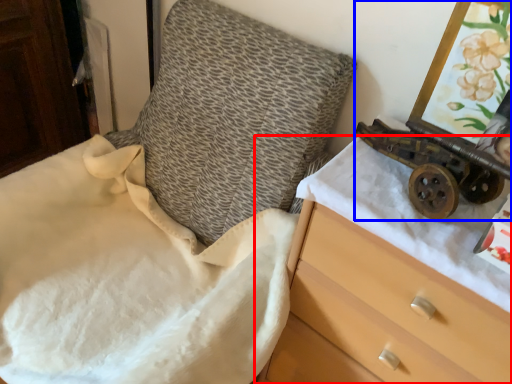
Question: Which of the following is the closest to the observer, chest of drawers (highlighted by a red box) or toy (highlighted by a blue box)?

Choices:
 (A) chest of drawers
 (B) toy

Answer: (A)